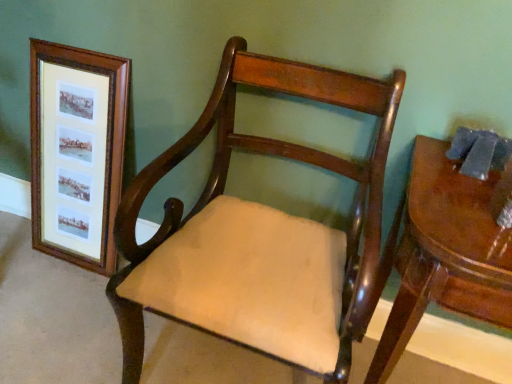
Question: In the image, is wooden frame at left on the left side or the right side of mahogany wood chair at center?

Choices:
 (A) left
 (B) right

Answer: (A)

Question: From a real-world perspective, is wooden frame at left above or below mahogany wood chair at center?

Choices:
 (A) below
 (B) above

Answer: (A)

Question: Which object is positioned closest to the wooden frame at left?

Choices:
 (A) mahogany wood chair at center
 (B) glossy wood table at right

Answer: (A)

Question: Which object is positioned farthest from the glossy wood table at right?

Choices:
 (A) mahogany wood chair at center
 (B) wooden frame at left

Answer: (B)